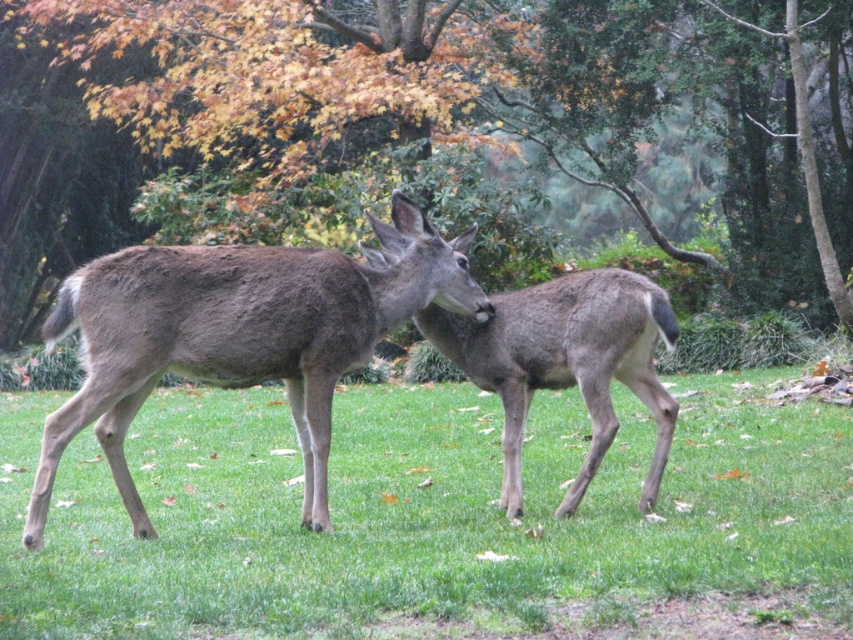
Question: Which point is closer to the camera taking this photo?

Choices:
 (A) (389, 321)
 (B) (846, 449)
 (C) (184, 243)

Answer: (A)

Question: Which of the following is the farthest from the observer?

Choices:
 (A) green grass at center
 (B) green leafy tree at center
 (C) gray fur deer at center

Answer: (B)

Question: Is green leafy tree at center to the left of gray fur deer at center from the viewer's perspective?

Choices:
 (A) yes
 (B) no

Answer: (A)

Question: Which point appears closest to the camera in this image?

Choices:
 (A) (223, 346)
 (B) (374, 227)

Answer: (A)

Question: From the image, what is the correct spatial relationship of brown fuzzy roe deer at center in relation to gray fur deer at center?

Choices:
 (A) right
 (B) left

Answer: (B)

Question: Can you confirm if green leafy tree at center is positioned below gray fur deer at center?

Choices:
 (A) no
 (B) yes

Answer: (A)